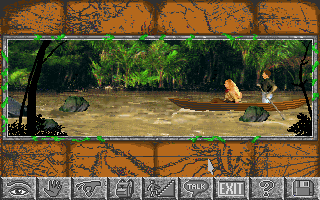
Find the location of `exit button`. exit button is located at coordinates (230, 187).